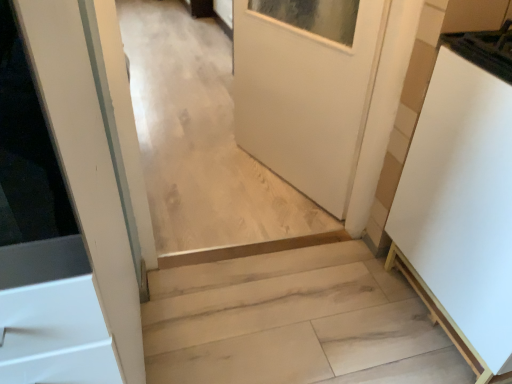
The width and height of the screenshot is (512, 384). In order to click on white matte cabinet at right in this screenshot , I will do `click(462, 200)`.

Describe the element at coordinates (462, 200) in the screenshot. I see `white matte cabinet at right` at that location.

Image resolution: width=512 pixels, height=384 pixels. What do you see at coordinates (293, 322) in the screenshot?
I see `light wood stairs at center` at bounding box center [293, 322].

Identify the location of light wood stairs at center. This screenshot has height=384, width=512. (293, 322).

Image resolution: width=512 pixels, height=384 pixels. I want to click on white matte cabinet at right, so click(x=462, y=200).

Can you confirm if light wood stairs at center is positioned to the left of white matte cabinet at right?

Yes.

Consider the image. Who is more distant, light wood stairs at center or white matte cabinet at right?

light wood stairs at center is more distant.

Is point (356, 286) positioned after point (442, 227)?

Yes, it is.

From the image's perspective, would you say light wood stairs at center is shown under white matte cabinet at right?

Correct, light wood stairs at center appears lower than white matte cabinet at right in the image.

From a real-world perspective, between light wood stairs at center and white matte cabinet at right, who is vertically higher?

In real-world perspective, white matte cabinet at right is above.

Looking at their sizes, would you say light wood stairs at center is wider or thinner than white matte cabinet at right?

light wood stairs at center is wider than white matte cabinet at right.

Can you confirm if light wood stairs at center is taller than white matte cabinet at right?

In fact, light wood stairs at center may be shorter than white matte cabinet at right.

Considering the sizes of objects light wood stairs at center and white matte cabinet at right in the image provided, who is bigger, light wood stairs at center or white matte cabinet at right?

white matte cabinet at right is bigger.

Would you say light wood stairs at center is inside or outside white matte cabinet at right?

The correct answer is: outside.

Is the surface of light wood stairs at center in direct contact with white matte cabinet at right?

light wood stairs at center and white matte cabinet at right are not in contact.

Is light wood stairs at center oriented away from white matte cabinet at right?

No, light wood stairs at center is not facing the opposite direction of white matte cabinet at right.

Measure the distance between light wood stairs at center and white matte cabinet at right.

light wood stairs at center and white matte cabinet at right are 18.66 inches apart from each other.

At what (x,y) coordinates should I click in order to perform the action: click on stairs below the white matte cabinet at right (from the image's perspective). Please return your answer as a coordinate pair (x, y). Image resolution: width=512 pixels, height=384 pixels. Looking at the image, I should click on (293, 322).

Does white matte cabinet at right appear on the right side of light wood stairs at center?

Yes, white matte cabinet at right is to the right of light wood stairs at center.

Which is behind, white matte cabinet at right or light wood stairs at center?

light wood stairs at center is more distant.

Considering the positions of points (501, 276) and (408, 309), is point (501, 276) closer to camera compared to point (408, 309)?

Yes, point (501, 276) is closer to viewer.

From the image's perspective, is white matte cabinet at right beneath light wood stairs at center?

No, from the image's perspective, white matte cabinet at right is not beneath light wood stairs at center.

From a real-world perspective, is white matte cabinet at right under light wood stairs at center?

Incorrect, from a real-world perspective, white matte cabinet at right is higher than light wood stairs at center.

Consider the image. Considering the sizes of objects white matte cabinet at right and light wood stairs at center in the image provided, who is wider, white matte cabinet at right or light wood stairs at center?

With larger width is light wood stairs at center.

Can you confirm if white matte cabinet at right is taller than light wood stairs at center?

Correct, white matte cabinet at right is much taller as light wood stairs at center.

Looking at the image, does white matte cabinet at right seem bigger or smaller compared to light wood stairs at center?

Considering their sizes, white matte cabinet at right takes up more space than light wood stairs at center.

Is light wood stairs at center located within white matte cabinet at right?

No, light wood stairs at center is located outside of white matte cabinet at right.

Is white matte cabinet at right placed right next to light wood stairs at center?

No, white matte cabinet at right is not with light wood stairs at center.

Is white matte cabinet at right oriented away from light wood stairs at center?

white matte cabinet at right does not have its back to light wood stairs at center.

Image resolution: width=512 pixels, height=384 pixels. I want to click on appliance in front of the light wood stairs at center, so click(x=462, y=200).

Identify the location of appliance above the light wood stairs at center (from the image's perspective). (462, 200).

Identify the location of stairs that appears behind the white matte cabinet at right. This screenshot has height=384, width=512. (293, 322).